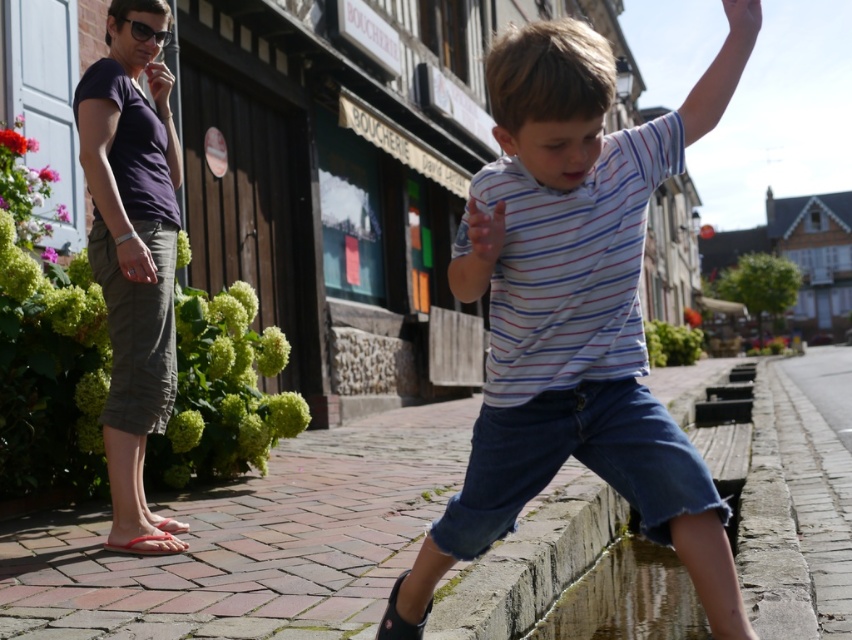
Question: Does white striped shirt at center appear under brick pavement at lower center?

Choices:
 (A) no
 (B) yes

Answer: (A)

Question: Is purple cotton shirt at upper left to the right of clear water at lower right from the viewer's perspective?

Choices:
 (A) yes
 (B) no

Answer: (B)

Question: Does brick pavement at lower center appear on the right side of purple cotton shirt at upper left?

Choices:
 (A) no
 (B) yes

Answer: (B)

Question: Which of these objects is positioned closest to the white striped shirt at center?

Choices:
 (A) purple cotton shirt at upper left
 (B) clear water at lower right
 (C) brick pavement at lower center

Answer: (C)

Question: Which object appears farthest from the camera in this image?

Choices:
 (A) brick pavement at lower center
 (B) clear water at lower right
 (C) white striped shirt at center

Answer: (B)

Question: Which of these objects is positioned farthest from the purple cotton shirt at upper left?

Choices:
 (A) white striped shirt at center
 (B) brick pavement at lower center
 (C) clear water at lower right

Answer: (C)